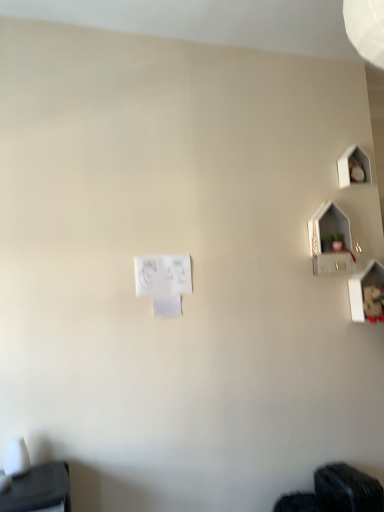
Question: Is white paper at center bigger than black fabric at lower right?

Choices:
 (A) no
 (B) yes

Answer: (A)

Question: From a real-world perspective, is white paper at center below black fabric at lower right?

Choices:
 (A) yes
 (B) no

Answer: (B)

Question: From the image's perspective, is white paper at center under black fabric at lower right?

Choices:
 (A) yes
 (B) no

Answer: (B)

Question: Is white paper at center far from black fabric at lower right?

Choices:
 (A) yes
 (B) no

Answer: (A)

Question: Is white paper at center completely or partially outside of black fabric at lower right?

Choices:
 (A) yes
 (B) no

Answer: (A)

Question: From their relative heights in the image, would you say matte gray shelf at upper right is taller or shorter than black fabric at lower right?

Choices:
 (A) short
 (B) tall

Answer: (B)

Question: In the image, is matte gray shelf at upper right positioned in front of or behind black fabric at lower right?

Choices:
 (A) front
 (B) behind

Answer: (B)

Question: Is matte gray shelf at upper right wider or thinner than black fabric at lower right?

Choices:
 (A) thin
 (B) wide

Answer: (A)

Question: Considering the positions of matte gray shelf at upper right and black fabric at lower right in the image, is matte gray shelf at upper right bigger or smaller than black fabric at lower right?

Choices:
 (A) big
 (B) small

Answer: (B)

Question: Is black fabric at lower right taller or shorter than white paper at center?

Choices:
 (A) tall
 (B) short

Answer: (A)

Question: Which is correct: black fabric at lower right is inside white paper at center, or outside of it?

Choices:
 (A) outside
 (B) inside

Answer: (A)

Question: From a real-world perspective, relative to white paper at center, is black fabric at lower right vertically above or below?

Choices:
 (A) below
 (B) above

Answer: (A)

Question: Is point (337, 486) positioned closer to the camera than point (168, 267)?

Choices:
 (A) farther
 (B) closer

Answer: (B)

Question: From a real-world perspective, is white paper at center positioned above or below matte gray shelf at upper right?

Choices:
 (A) below
 (B) above

Answer: (A)

Question: In terms of height, does white paper at center look taller or shorter compared to matte gray shelf at upper right?

Choices:
 (A) tall
 (B) short

Answer: (B)